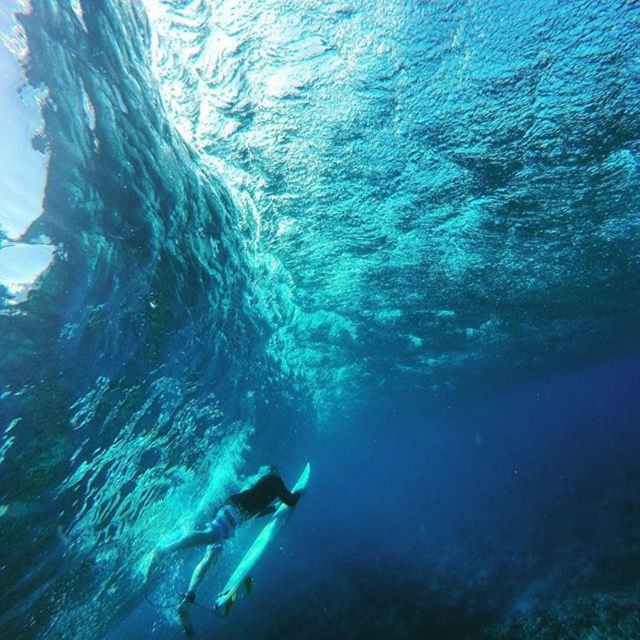
Question: Does smooth skin diver at lower center come in front of white glossy surfboard at lower center?

Choices:
 (A) no
 (B) yes

Answer: (B)

Question: Which object is farther from the camera taking this photo?

Choices:
 (A) smooth skin diver at lower center
 (B) white glossy surfboard at lower center

Answer: (B)

Question: Is smooth skin diver at lower center behind white glossy surfboard at lower center?

Choices:
 (A) yes
 (B) no

Answer: (B)

Question: Which point is closer to the camera?

Choices:
 (A) smooth skin diver at lower center
 (B) white glossy surfboard at lower center

Answer: (A)

Question: Does smooth skin diver at lower center lie in front of white glossy surfboard at lower center?

Choices:
 (A) yes
 (B) no

Answer: (A)

Question: Which of the following is the closest to the observer?

Choices:
 (A) smooth skin diver at lower center
 (B) white glossy surfboard at lower center

Answer: (A)